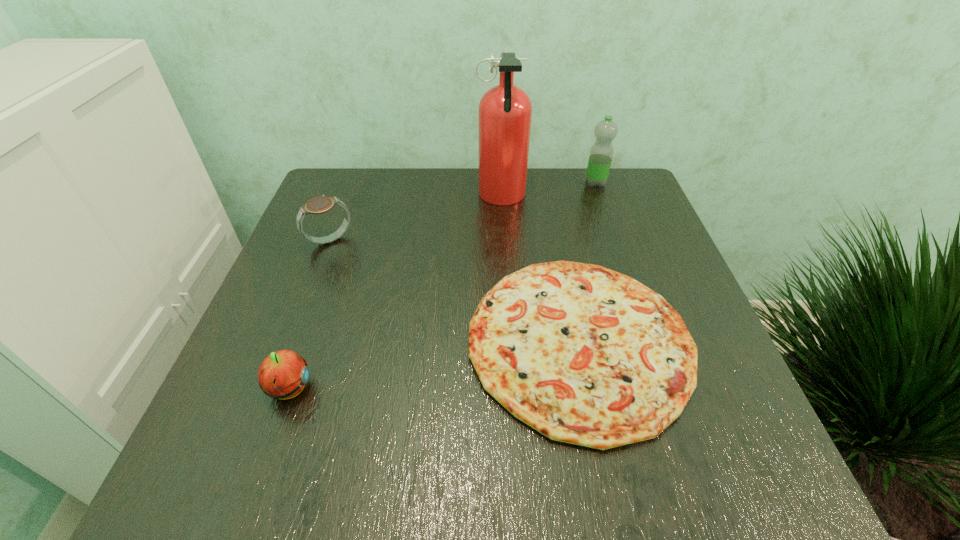
At what (x,y) coordinates should I click in order to perform the action: click on vacant space located 0.290m on the left of the pizza. Please return your answer as a coordinate pair (x, y). This screenshot has width=960, height=540. Looking at the image, I should click on (311, 342).

The width and height of the screenshot is (960, 540). Find the location of `fire extinguisher at the far edge`. fire extinguisher at the far edge is located at coordinates (505, 111).

Where is `water bottle that is positioned at the far edge`? The image size is (960, 540). water bottle that is positioned at the far edge is located at coordinates (601, 153).

Find the location of a particular element. Image resolution: width=960 pixels, height=540 pixels. object located at the near edge is located at coordinates (585, 355).

The height and width of the screenshot is (540, 960). I want to click on watch at the left edge, so pos(318,205).

Where is `apple that is at the left edge`? apple that is at the left edge is located at coordinates (283, 374).

You are a GUI agent. You are given a task and a screenshot of the screen. Output one action in this format:
    pyautogui.click(x=<x>, y=<y>)
    Task: Click on the water bottle that is at the right edge
    The height and width of the screenshot is (540, 960).
    Given the screenshot: What is the action you would take?
    pyautogui.click(x=601, y=153)

This screenshot has width=960, height=540. Find the location of `pizza that is at the right edge`. pizza that is at the right edge is located at coordinates (585, 355).

Where is `object located at the far right corner`? Image resolution: width=960 pixels, height=540 pixels. object located at the far right corner is located at coordinates (601, 153).

The width and height of the screenshot is (960, 540). I want to click on object that is positioned at the near right corner, so click(585, 355).